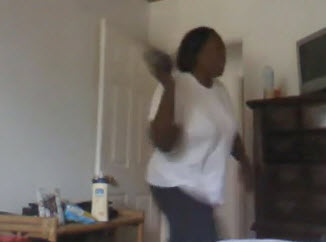
The image size is (326, 242). I want to click on door, so (x=120, y=90).